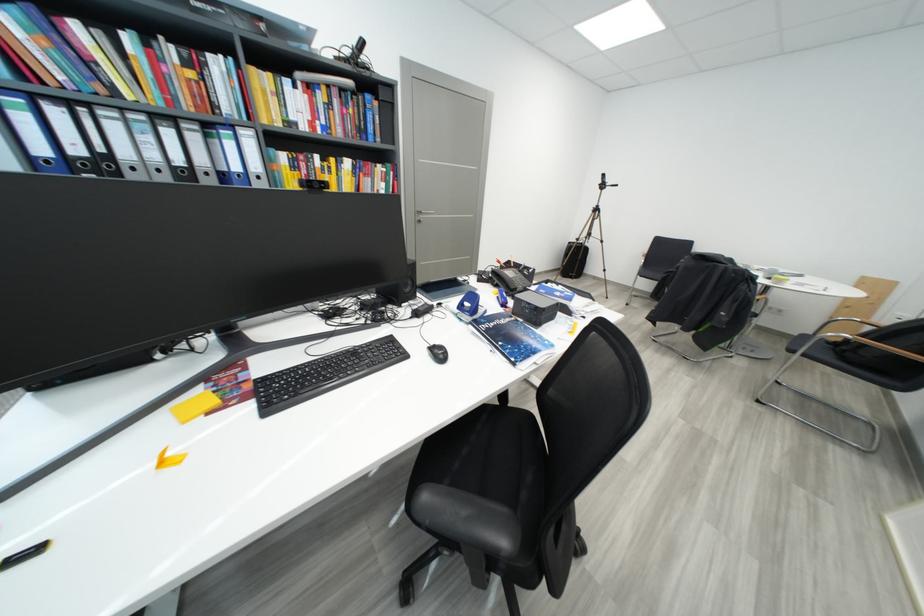
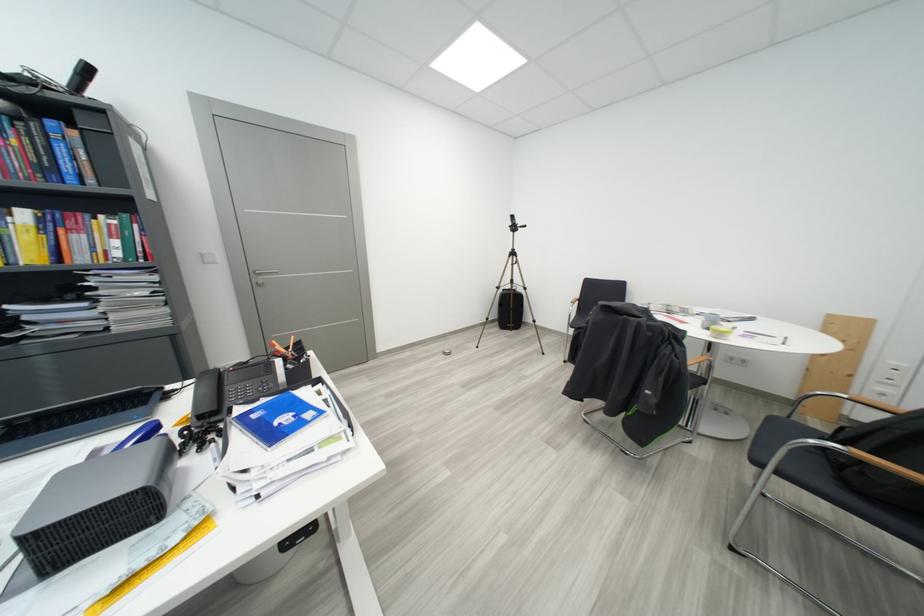
In the second image, find the point that corresponds to (x=357, y=164) in the first image.

(32, 216)